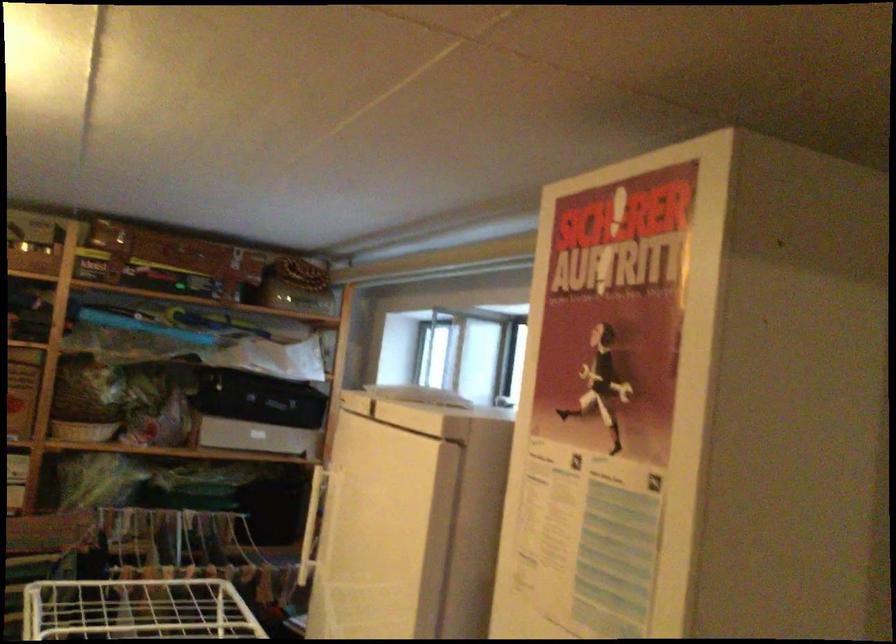
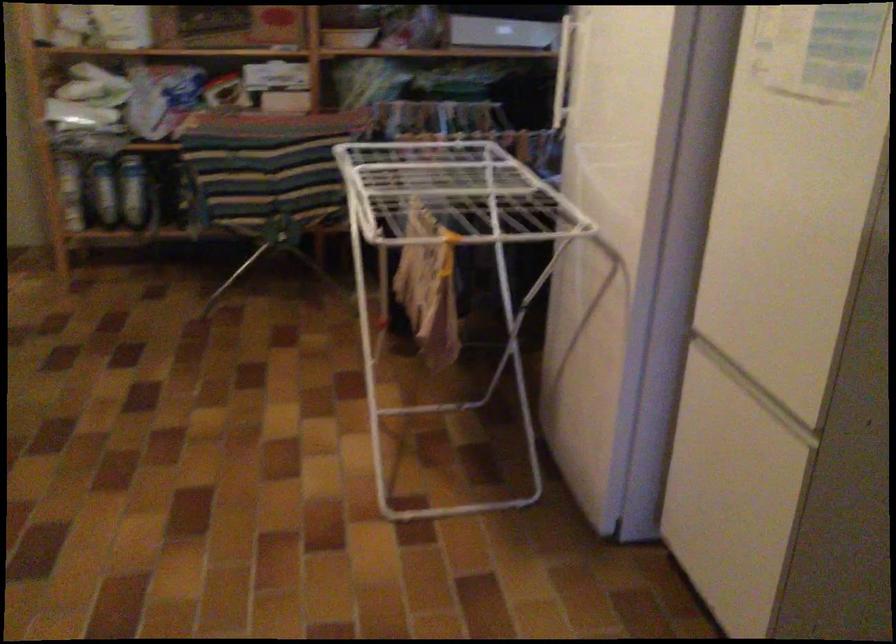
Find the pixel in the second image that matches the point at 316,521 in the first image.

(563, 69)